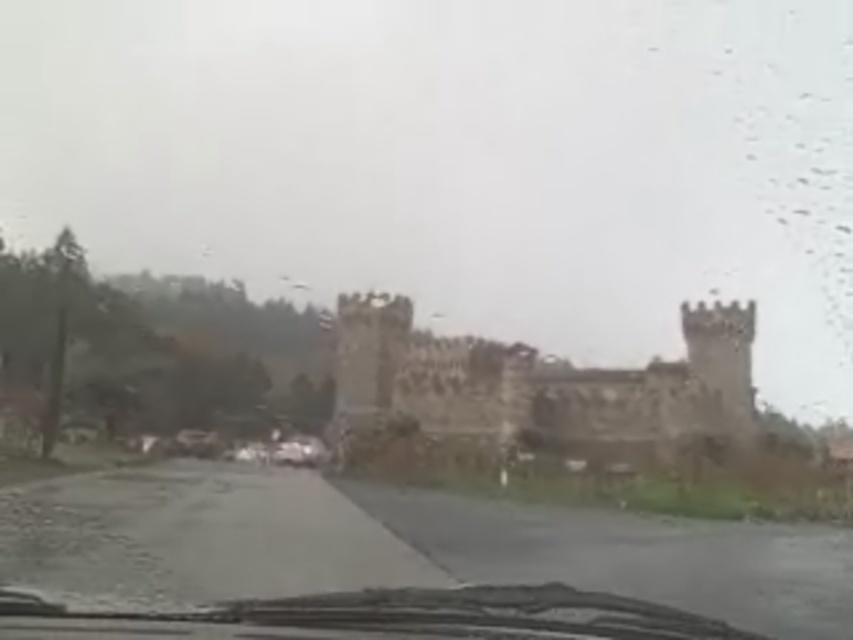
Is point (431, 429) in front of point (421, 620)?

No, it is not.

Which of these two, brown stone castle at center or transparent glass windshield at center, stands shorter?

With less height is transparent glass windshield at center.

Does point (491, 410) come in front of point (7, 628)?

No.

This screenshot has width=853, height=640. In order to click on brown stone castle at center in this screenshot , I will do `click(524, 392)`.

Does transparent glass windshield at center have a smaller size compared to metallic silver car at center?

No.

Consider the image. Can you confirm if transparent glass windshield at center is bigger than metallic silver car at center?

Yes, transparent glass windshield at center is bigger than metallic silver car at center.

Who is more forward, (529,605) or (303,458)?

Point (529,605) is more forward.

You are a GUI agent. You are given a task and a screenshot of the screen. Output one action in this format:
    pyautogui.click(x=<x>, y=<y>)
    Task: Click on the transparent glass windshield at center
    Image resolution: width=853 pixels, height=640 pixels.
    Given the screenshot: What is the action you would take?
    pyautogui.click(x=381, y=616)

Locate an element on the screen. The image size is (853, 640). brown stone castle at center is located at coordinates (524, 392).

Who is higher up, brown stone castle at center or metallic silver car at center?

brown stone castle at center is higher up.

Is point (479, 420) positioned in front of point (312, 442)?

Yes.

Where is `brown stone castle at center`? brown stone castle at center is located at coordinates (524, 392).